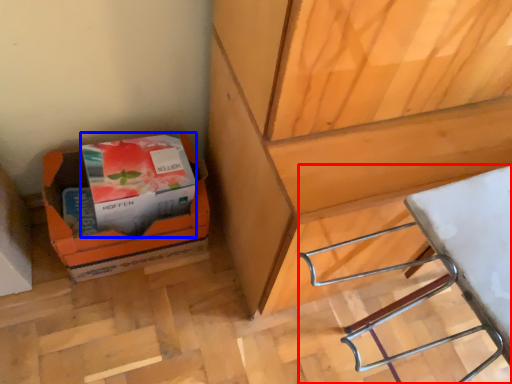
Question: Which of the following is the closest to the observer, wood (highlighted by a red box) or paperback book (highlighted by a blue box)?

Choices:
 (A) wood
 (B) paperback book

Answer: (A)